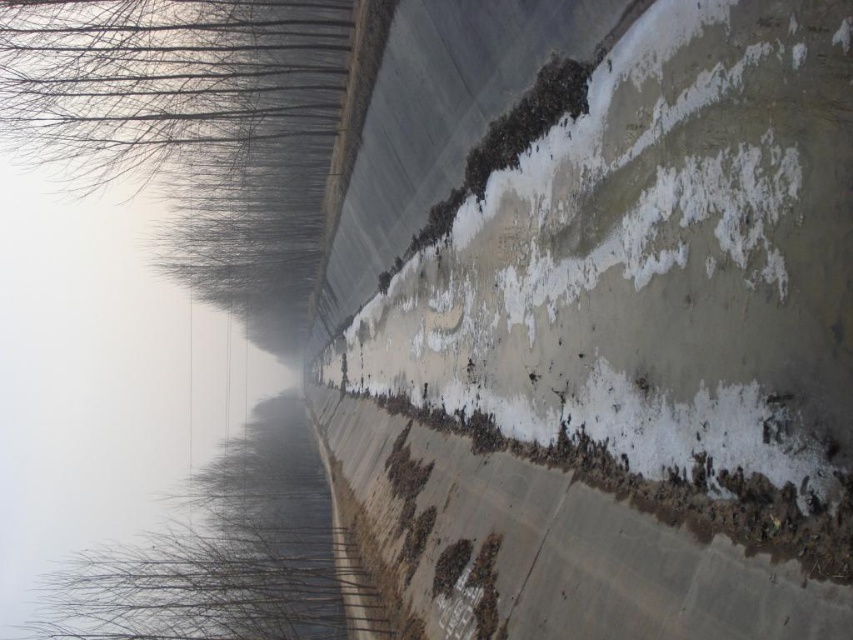
Question: Can you confirm if white rough concrete at center is positioned above transparent water at upper left?

Choices:
 (A) yes
 (B) no

Answer: (A)

Question: Considering the relative positions of white rough concrete at center and transparent water at upper left in the image provided, where is white rough concrete at center located with respect to transparent water at upper left?

Choices:
 (A) left
 (B) right

Answer: (B)

Question: Does white rough concrete at center have a smaller size compared to transparent water at upper left?

Choices:
 (A) yes
 (B) no

Answer: (A)

Question: Which of the following is the farthest from the observer?

Choices:
 (A) transparent water at upper left
 (B) white rough concrete at center

Answer: (A)